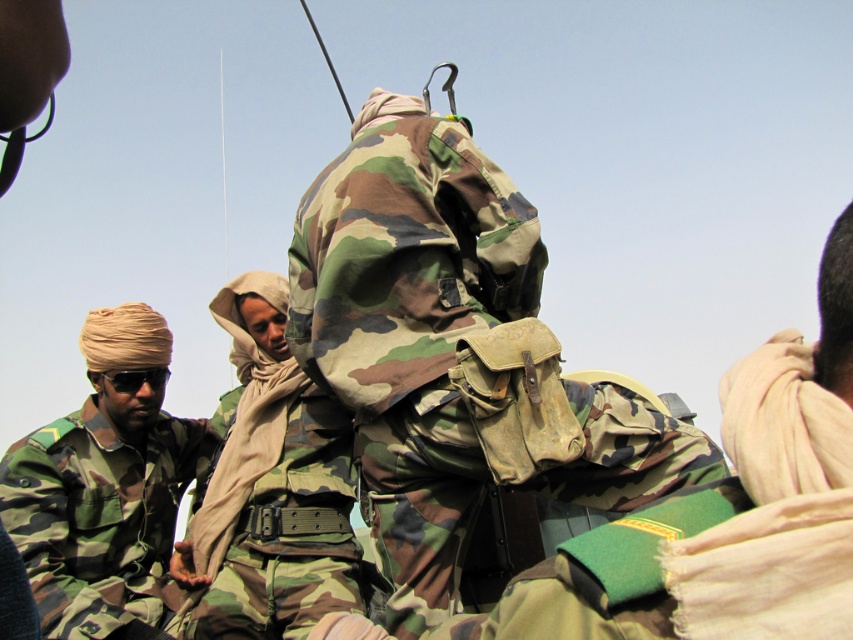
Question: Based on their relative distances, which object is nearer to the camo fabric uniform at center?

Choices:
 (A) camouflage fabric backpack at center
 (B) camouflage fabric uniform at left

Answer: (B)

Question: Does camouflage fabric uniform at left appear on the right side of camo fabric uniform at center?

Choices:
 (A) no
 (B) yes

Answer: (A)

Question: Based on their relative distances, which object is nearer to the camo fabric uniform at center?

Choices:
 (A) camouflage fabric backpack at center
 (B) camouflage fabric uniform at left

Answer: (B)

Question: Which of the following is the closest to the observer?

Choices:
 (A) camo fabric uniform at center
 (B) camouflage fabric backpack at center
 (C) camouflage fabric uniform at left

Answer: (B)

Question: Does camouflage fabric uniform at left appear over camo fabric uniform at center?

Choices:
 (A) yes
 (B) no

Answer: (A)

Question: Can you confirm if camouflage fabric backpack at center is smaller than camouflage fabric uniform at left?

Choices:
 (A) no
 (B) yes

Answer: (B)